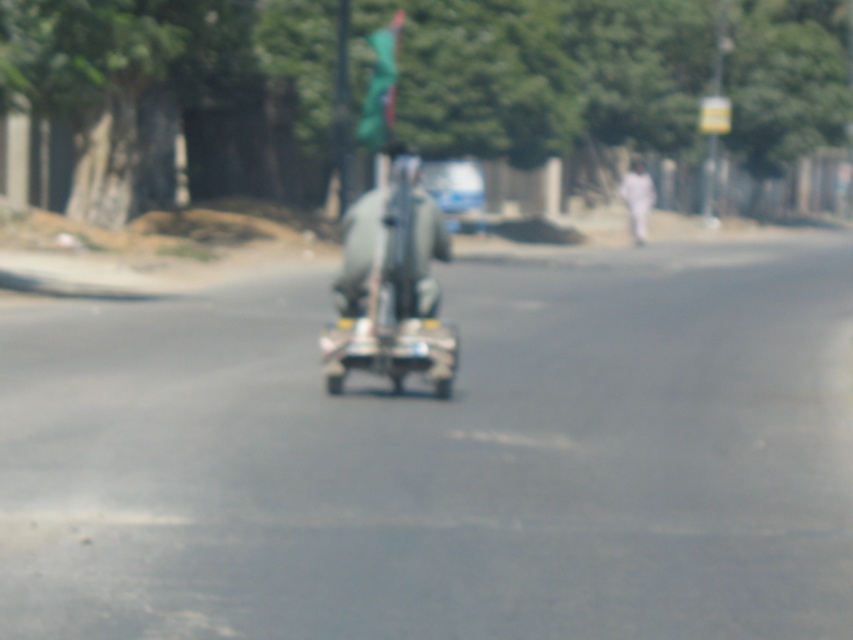
Question: Among these points, which one is farthest from the camera?

Choices:
 (A) (424, 184)
 (B) (370, 365)
 (C) (335, 276)

Answer: (A)

Question: Is metallic silver scooter at center bigger than metallic silver car at center?

Choices:
 (A) yes
 (B) no

Answer: (B)

Question: From the image, what is the correct spatial relationship of metallic silver scooter at center in relation to metallic silver car at center?

Choices:
 (A) left
 (B) right

Answer: (A)

Question: Estimate the real-world distances between objects in this image. Which object is closer to the metallic silver car at center?

Choices:
 (A) metallic gray figure at center
 (B) metallic silver scooter at center

Answer: (B)

Question: Among these points, which one is farthest from the camera?

Choices:
 (A) (463, 212)
 (B) (389, 339)
 (C) (426, 314)

Answer: (A)

Question: Considering the relative positions of metallic silver scooter at center and metallic gray figure at center in the image provided, where is metallic silver scooter at center located with respect to metallic gray figure at center?

Choices:
 (A) left
 (B) right

Answer: (B)